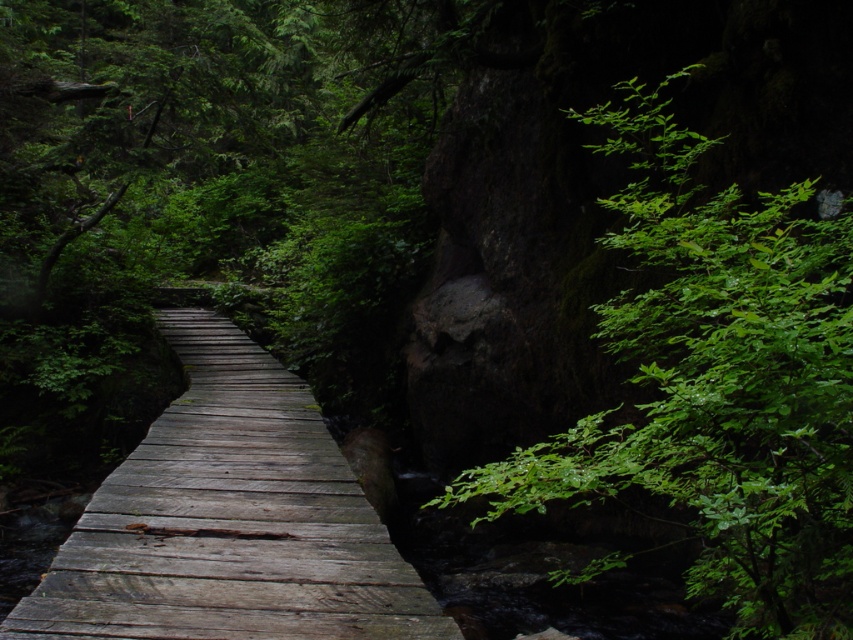
Which is below, green leafy tree at right or wooden bridge at center?

Positioned lower is wooden bridge at center.

Is point (828, 513) positioned in front of point (175, 330)?

Yes, point (828, 513) is in front of point (175, 330).

The image size is (853, 640). Find the location of `green leafy tree at right`. green leafy tree at right is located at coordinates (717, 384).